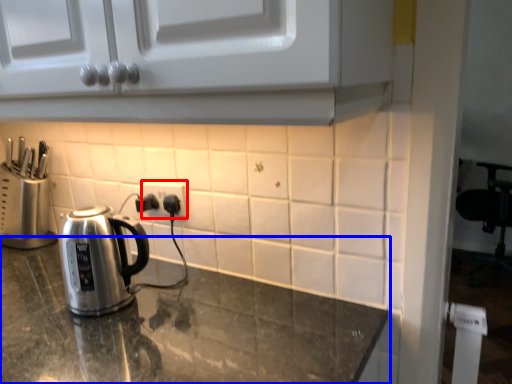
Question: Among these objects, which one is farthest to the camera, electric outlet (highlighted by a red box) or countertop (highlighted by a blue box)?

Choices:
 (A) electric outlet
 (B) countertop

Answer: (A)